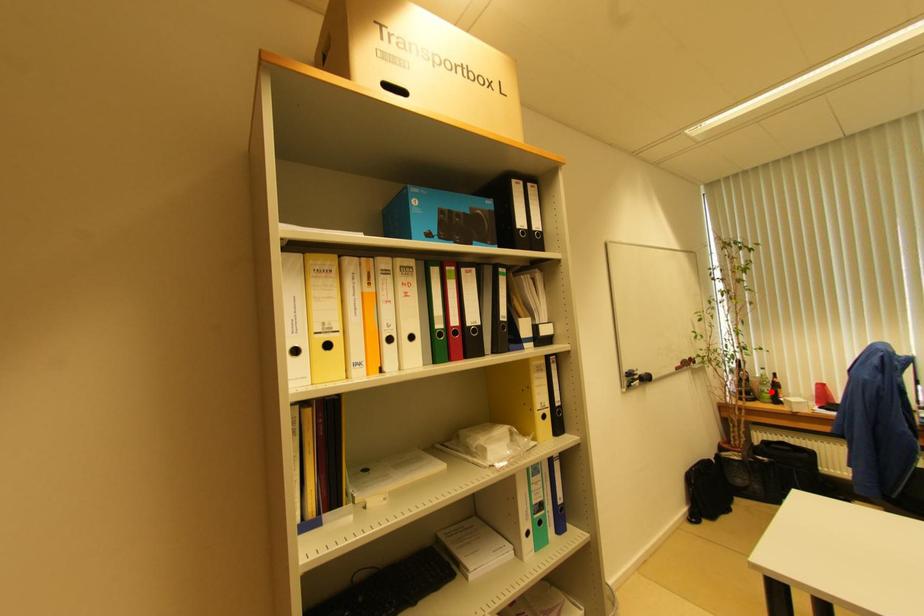
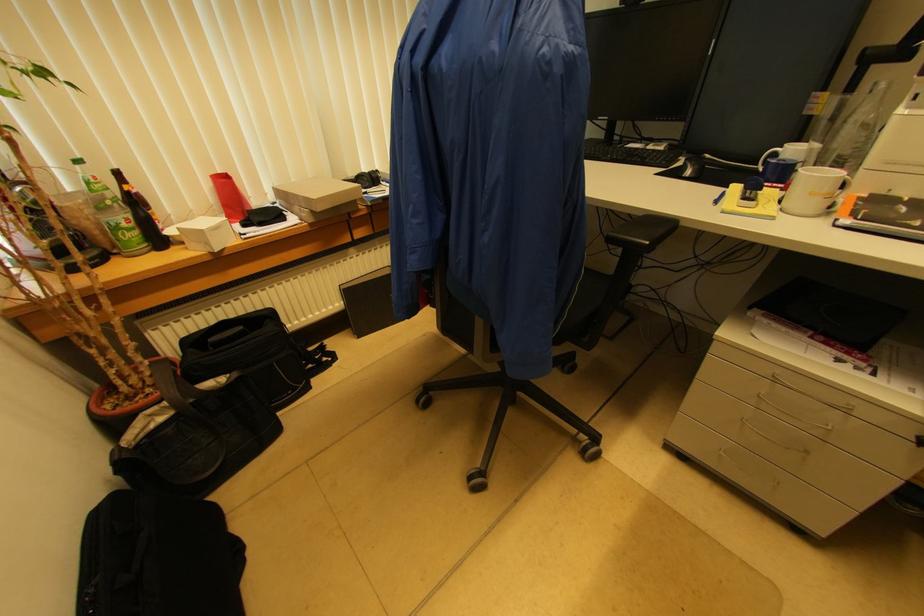
In the second image, find the point that corresponds to the highlighted location in the first image.

(131, 219)